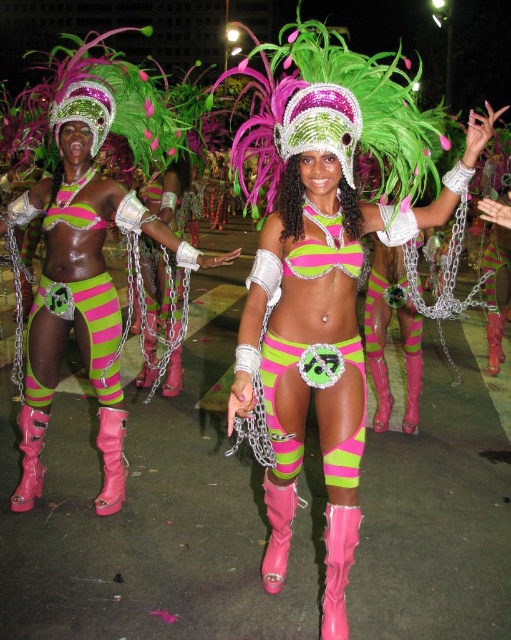
Is neon green matte bikini top at center further to camera compared to pink matte bikini top at center?

No, it is in front of pink matte bikini top at center.

Can you confirm if neon green matte bikini top at center is shorter than pink matte bikini top at center?

No, neon green matte bikini top at center is not shorter than pink matte bikini top at center.

Who is more distant from viewer, (352,116) or (349,259)?

Point (349,259)

This screenshot has width=511, height=640. In order to click on neon green matte bikini top at center in this screenshot , I will do `click(318, 330)`.

Does neon green matte bikini top at upper center have a lesser width compared to pink matte bikini top at center?

No.

Does neon green matte bikini top at upper center have a smaller size compared to pink matte bikini top at center?

Incorrect, neon green matte bikini top at upper center is not smaller in size than pink matte bikini top at center.

Find the location of a particular element. neon green matte bikini top at upper center is located at coordinates (81, 285).

Can you confirm if neon green matte bikini top at center is thinner than neon green matte bikini top at upper center?

Yes.

Does neon green matte bikini top at center appear on the left side of neon green matte bikini top at upper center?

Incorrect, neon green matte bikini top at center is not on the left side of neon green matte bikini top at upper center.

The height and width of the screenshot is (640, 511). Describe the element at coordinates (318, 330) in the screenshot. I see `neon green matte bikini top at center` at that location.

You are a GUI agent. You are given a task and a screenshot of the screen. Output one action in this format:
    pyautogui.click(x=<x>, y=<y>)
    Task: Click on the neon green matte bikini top at center
    This screenshot has height=640, width=511.
    Given the screenshot: What is the action you would take?
    pyautogui.click(x=318, y=330)